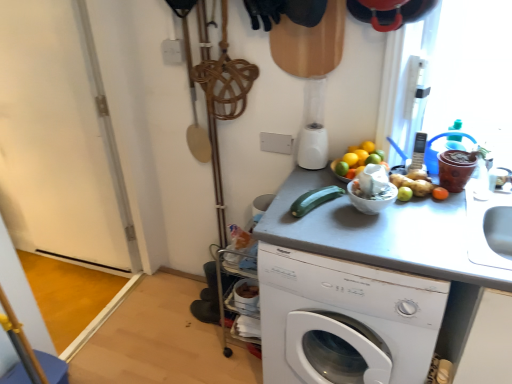
The image size is (512, 384). Find the location of `vacant area in front of white glossy bowl at upper right`. vacant area in front of white glossy bowl at upper right is located at coordinates (388, 240).